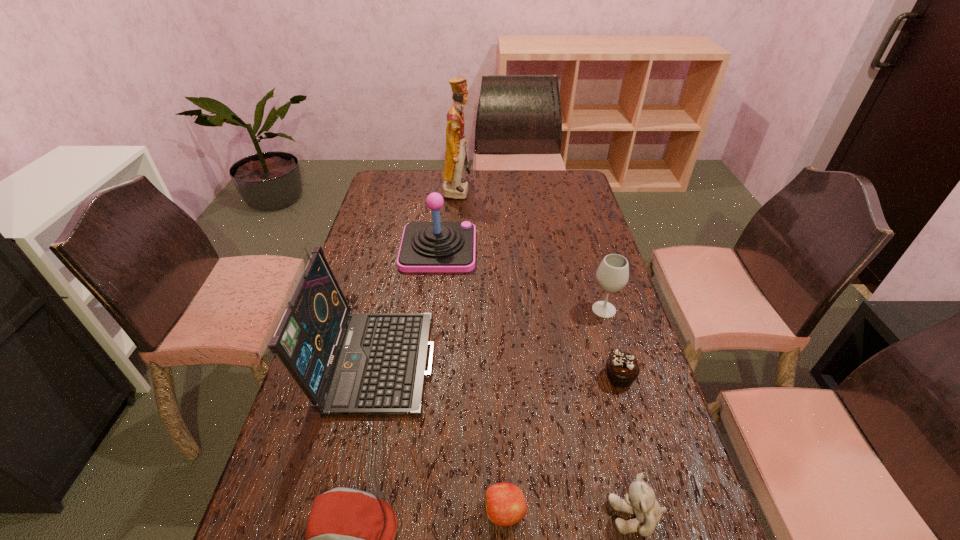
The image size is (960, 540). In order to click on nutcracker in this screenshot , I will do click(x=454, y=186).

I want to click on the farthest object, so click(454, 186).

Where is `the seventh shortest object`? The image size is (960, 540). the seventh shortest object is located at coordinates (347, 363).

The image size is (960, 540). I want to click on the second farthest object, so click(436, 246).

The image size is (960, 540). I want to click on the fifth shortest object, so click(612, 275).

Locate an element on the screen. This screenshot has height=540, width=960. cupcake is located at coordinates (622, 367).

Identify the location of the fifth object from left to right. (506, 505).

I want to click on vacant space located on the front-facing side of the tallest object, so click(506, 191).

The height and width of the screenshot is (540, 960). Identify the location of vacant space located on the front-facing side of the seventh shortest object. (574, 357).

The width and height of the screenshot is (960, 540). I want to click on free region located forward from the base of the joystick, so click(x=567, y=248).